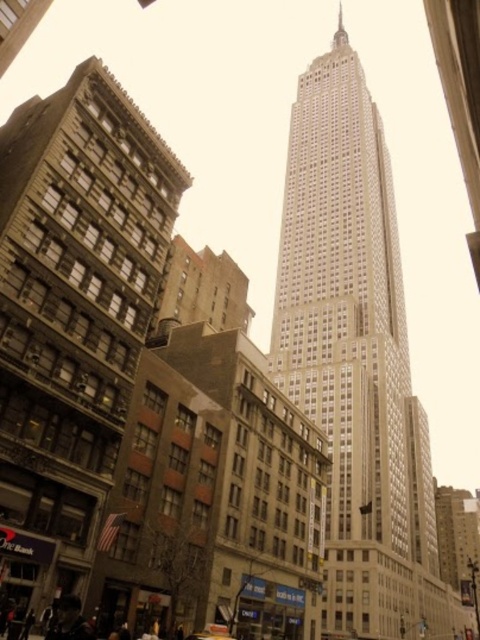
Question: Can you confirm if brown stone building at left is positioned to the left of beige stone tower at center?

Choices:
 (A) yes
 (B) no

Answer: (A)

Question: Is brown stone building at left positioned before beige stone tower at center?

Choices:
 (A) no
 (B) yes

Answer: (B)

Question: Which object is the farthest from the metallic silver car at center?

Choices:
 (A) beige stone tower at center
 (B) brown stone building at left

Answer: (A)

Question: Which object is closer to the camera taking this photo?

Choices:
 (A) metallic silver car at center
 (B) beige stone tower at center

Answer: (A)

Question: Does beige stone tower at center appear on the left side of metallic silver car at center?

Choices:
 (A) no
 (B) yes

Answer: (A)

Question: Among these points, which one is nearest to the camera?

Choices:
 (A) (60, 445)
 (B) (398, 513)
 (C) (199, 636)

Answer: (A)